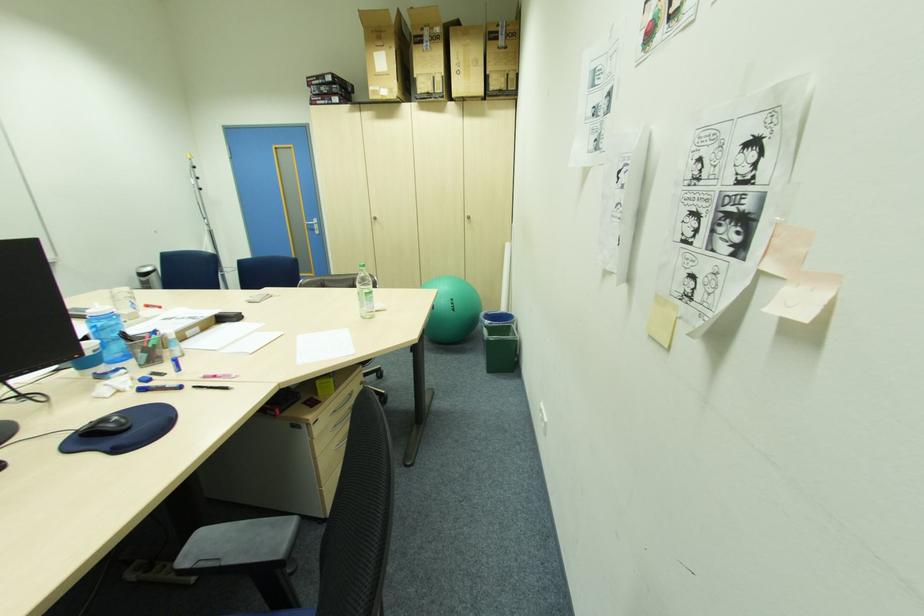
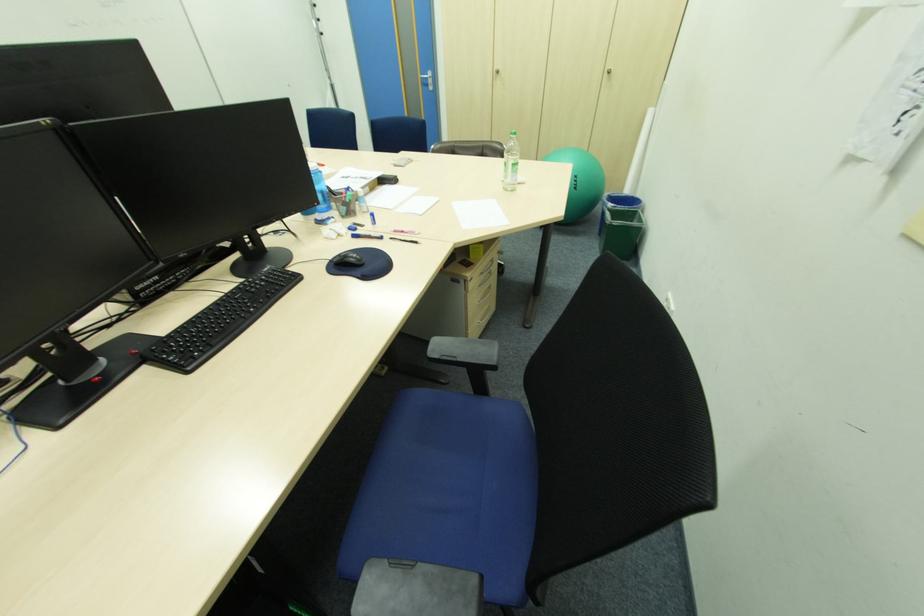
Where in the second image is the point corresponding to (199,387) from the first image?

(396, 238)